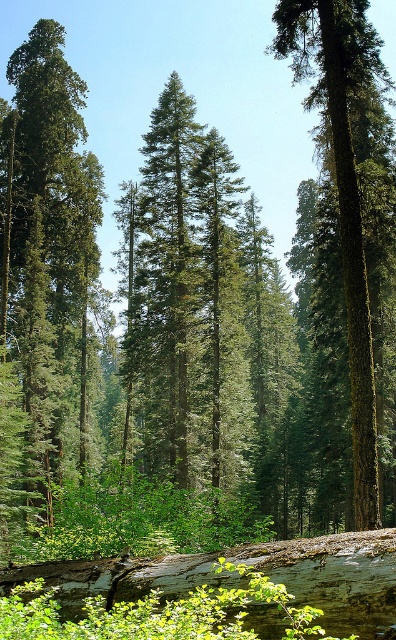
Question: Is green rough bark tree at left to the right of green mossy tree at center from the viewer's perspective?

Choices:
 (A) no
 (B) yes

Answer: (A)

Question: Is green rough bark tree at left thinner than green mossy tree at center?

Choices:
 (A) no
 (B) yes

Answer: (A)

Question: Is green rough bark tree at left thinner than green mossy tree at center?

Choices:
 (A) no
 (B) yes

Answer: (A)

Question: Which of the following is the closest to the observer?

Choices:
 (A) green rough bark tree at left
 (B) green mossy tree at center

Answer: (B)

Question: Which point is closer to the camera taking this photo?

Choices:
 (A) (53, 380)
 (B) (363, 276)

Answer: (B)